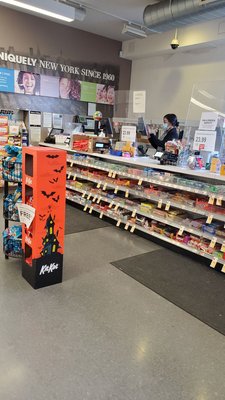
This screenshot has height=400, width=225. I want to click on poster, so click(x=83, y=79).